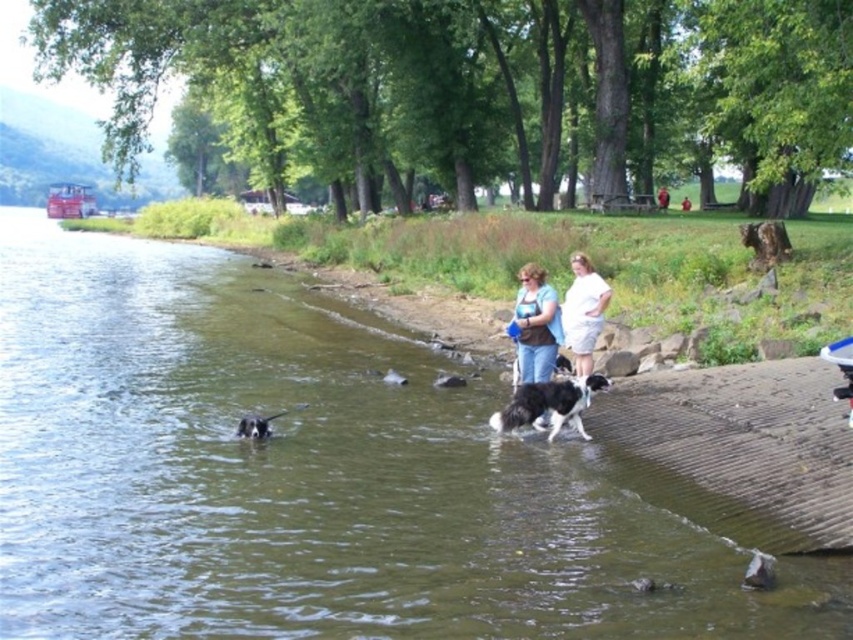
You are planning to take a photo of the blue jeans at center and the white cotton shirt at center for a clothing catalog. The catalog requires that the larger item should be placed in the foreground to emphasize its size. Based on the scene description, which clothing item should you position closer to the camera?

The blue jeans at center has a larger size compared to the white cotton shirt at center, so you should position the blue jeans at center closer to the camera to emphasize its size in the photo.